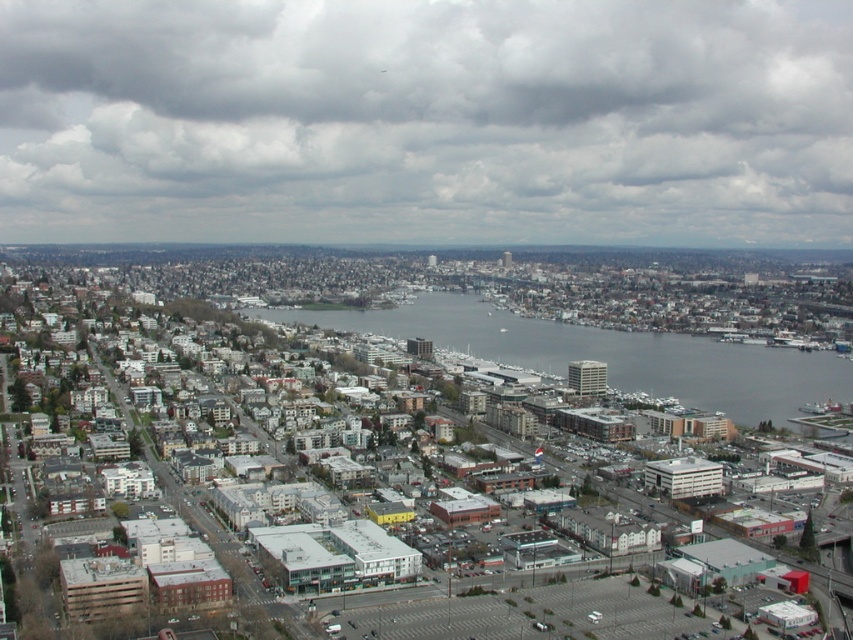
Who is more distant from viewer, (x=500, y=13) or (x=720, y=388)?

The point (x=720, y=388) is behind.

Can you confirm if cloudy sky at upper center is positioned to the right of gray water at center?

No, cloudy sky at upper center is not to the right of gray water at center.

What do you see at coordinates (426, 122) in the screenshot? The width and height of the screenshot is (853, 640). I see `cloudy sky at upper center` at bounding box center [426, 122].

Image resolution: width=853 pixels, height=640 pixels. I want to click on cloudy sky at upper center, so click(426, 122).